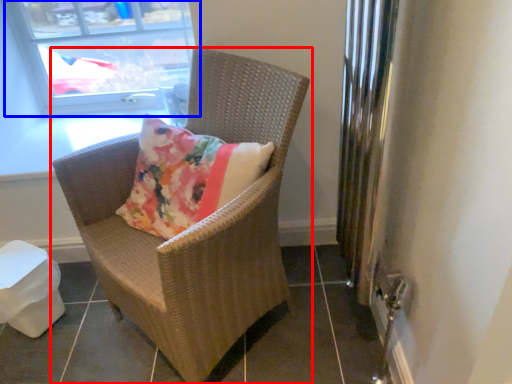
Question: Which object appears closest to the camera in this image, chair (highlighted by a red box) or window (highlighted by a blue box)?

Choices:
 (A) chair
 (B) window

Answer: (A)